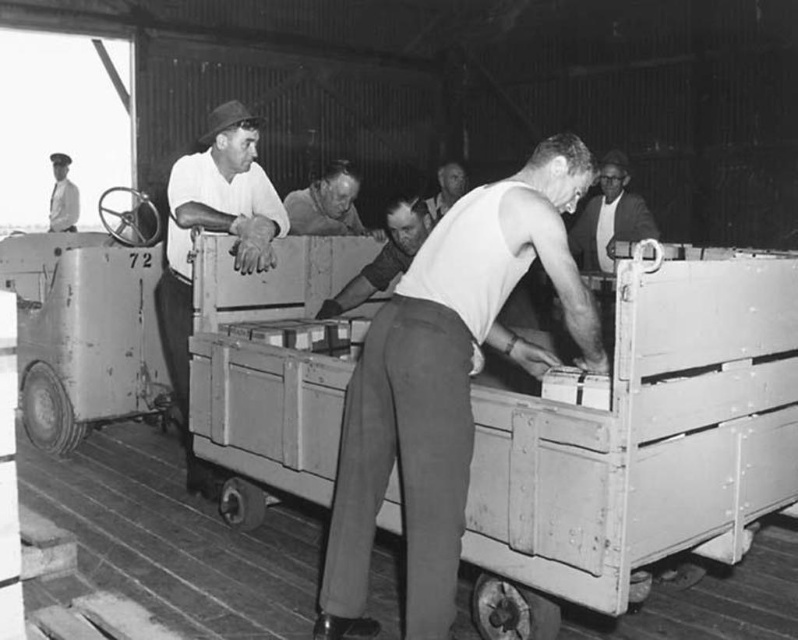
Question: Which object is closer to the camera taking this photo?

Choices:
 (A) smooth gray shirt at upper right
 (B) smooth white shirt at center

Answer: (A)

Question: Which point is farther from the camera taking this photo?

Choices:
 (A) (74, 224)
 (B) (447, 170)
 (C) (334, 225)

Answer: (A)

Question: Among these objects, which one is nearest to the camera?

Choices:
 (A) wooden crate at center
 (B) white smooth shirt at center
 (C) smooth gray shirt at upper right
 (D) smooth white shirt at center

Answer: (A)

Question: Is white smooth shirt at center bigger than smooth gray shirt at upper right?

Choices:
 (A) no
 (B) yes

Answer: (B)

Question: Is white smooth shirt at center thinner than smooth skin face at center?

Choices:
 (A) no
 (B) yes

Answer: (A)

Question: Considering the relative positions of wooden crate at center and smooth skin face at center in the image provided, where is wooden crate at center located with respect to smooth skin face at center?

Choices:
 (A) left
 (B) right

Answer: (B)